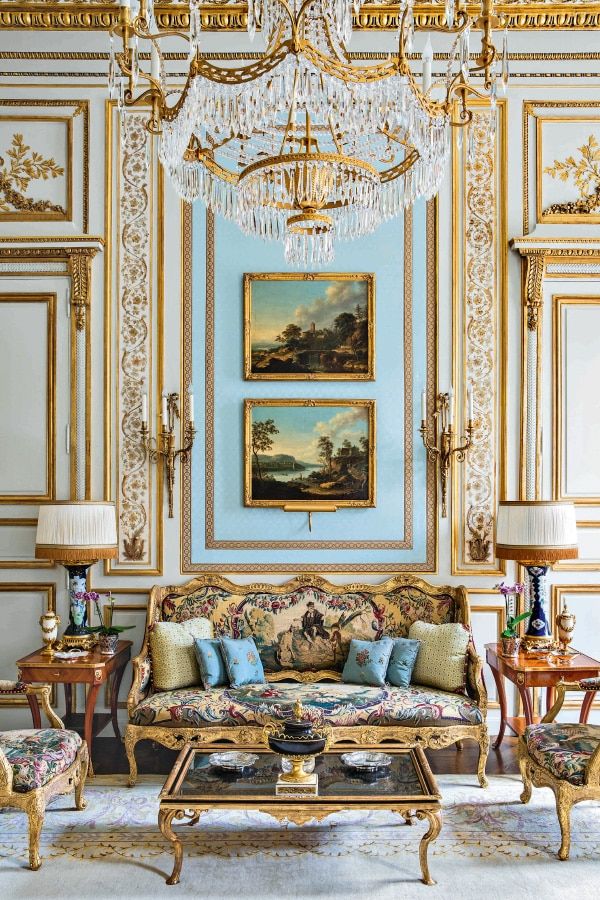
Find the location of a particular element. sofa is located at coordinates (293, 654).